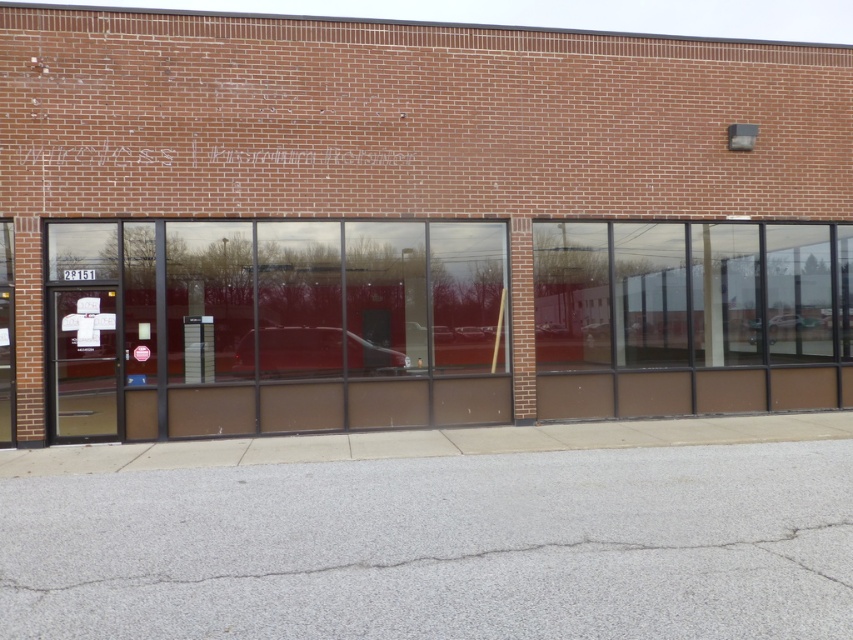
What object is located at the coordinates point (421, 220) in the image?

The point (421, 220) corresponds to the brown glass storefront at center.

Based on the photo, you are a delivery person approaching the building and need to find the entrance. The clear glass door at left is the main entrance. Which direction should you walk from the brown glass storefront at center to reach it?

The brown glass storefront at center is to the right of the clear glass door at left. To reach the clear glass door at left from the brown glass storefront at center, you should walk to the left.

You are a delivery person trying to enter the building. You see the brown glass storefront at center and the clear glass door at left. Which one should you use to enter?

The clear glass door at left is the entrance, so you should use the clear glass door at left to enter.